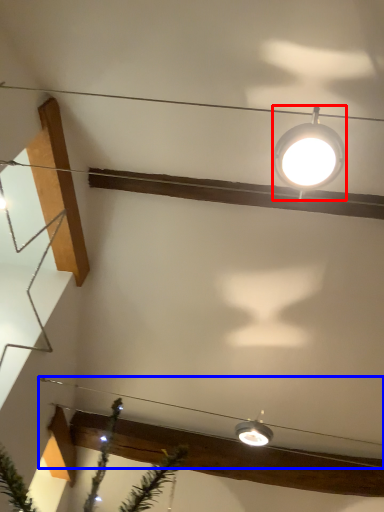
Question: Which object appears farthest to the camera in this image, lamp (highlighted by a red box) or wire (highlighted by a blue box)?

Choices:
 (A) lamp
 (B) wire

Answer: (B)